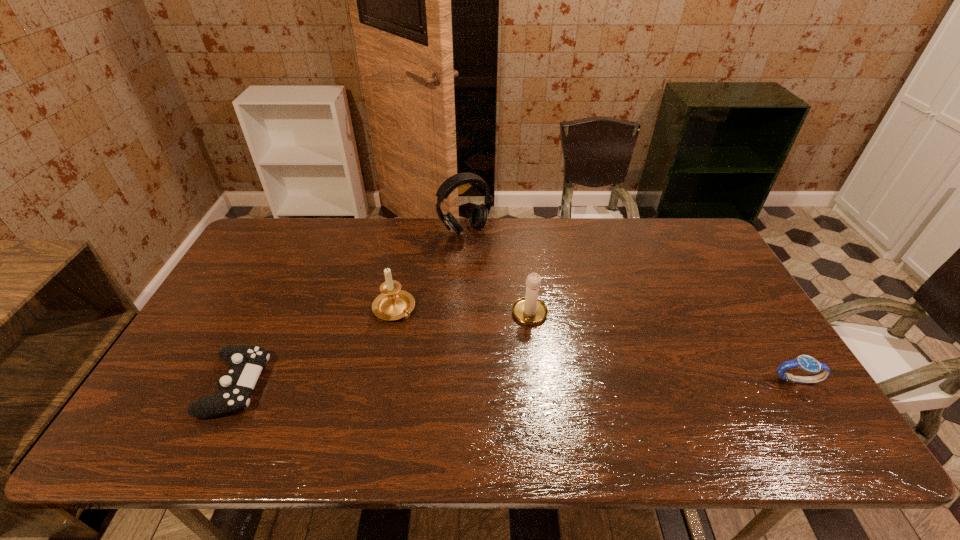
Where is `free spot between the rightmost object and the right candle holder`? The width and height of the screenshot is (960, 540). free spot between the rightmost object and the right candle holder is located at coordinates (663, 347).

At what (x,y) coordinates should I click in order to perform the action: click on free space between the fourth object from left to right and the watch. Please return your answer as a coordinate pair (x, y). This screenshot has width=960, height=540. Looking at the image, I should click on (663, 347).

This screenshot has height=540, width=960. Find the location of `free space between the fourth object from left to right and the watch`. free space between the fourth object from left to right and the watch is located at coordinates (663, 347).

The height and width of the screenshot is (540, 960). I want to click on vacant space in between the watch and the tallest object, so click(x=631, y=306).

Identify the location of free space that is in between the farthest object and the right candle holder. The image size is (960, 540). (497, 273).

Where is `unoccupied area between the watch and the second object from left to right`? The image size is (960, 540). unoccupied area between the watch and the second object from left to right is located at coordinates (595, 344).

Locate an element on the screen. free space between the leftmost object and the fourth object from left to right is located at coordinates (383, 350).

The image size is (960, 540). Find the location of `free space between the farthest object and the second object from left to right`. free space between the farthest object and the second object from left to right is located at coordinates (430, 270).

At what (x,y) coordinates should I click in order to perform the action: click on free space between the leftmost object and the watch. Please return your answer as a coordinate pair (x, y). The image size is (960, 540). Looking at the image, I should click on (516, 382).

Locate which object ranks third in proximity to the fourth object from left to right. Please provide its 2D coordinates. Your answer should be formatted as a tuple, i.e. [(x, y)], where the tuple contains the x and y coordinates of a point satisfying the conditions above.

[(806, 363)]